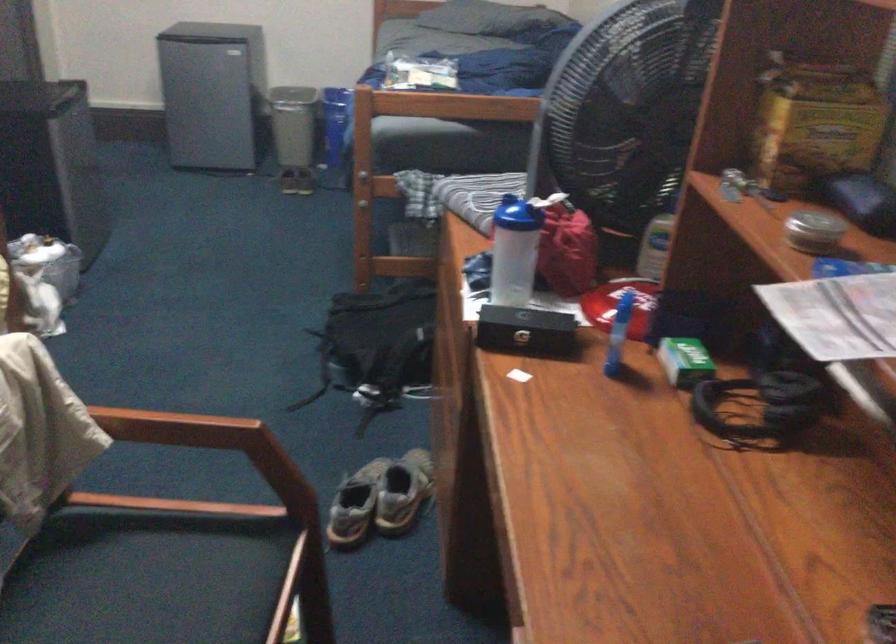
Which object does [513,251] point to?

It refers to a shaker bottle.